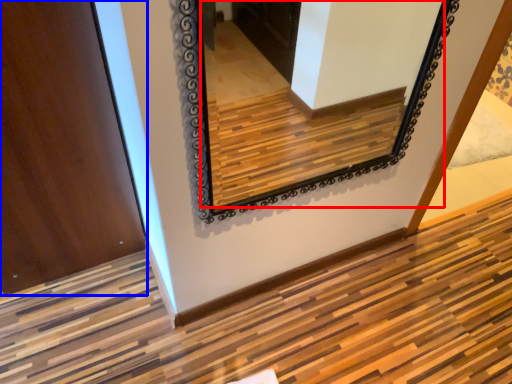
Question: Which object appears closest to the camera in this image, mirror (highlighted by a red box) or door (highlighted by a blue box)?

Choices:
 (A) mirror
 (B) door

Answer: (A)